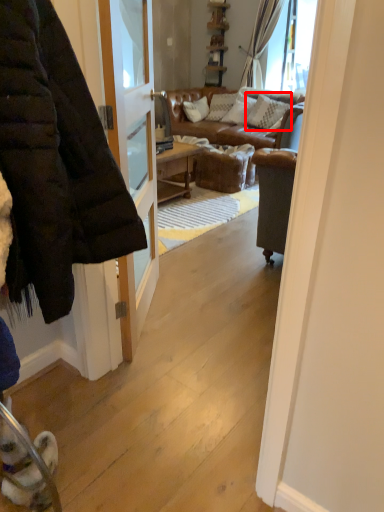
Question: Observing the image, what is the correct spatial positioning of pillow (annotated by the red box) in reference to jacket?

Choices:
 (A) right
 (B) left

Answer: (A)